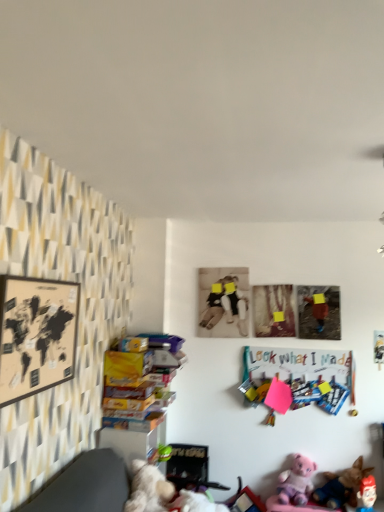
Question: Is fluffy white teddy bear at lower center, acting as the 1th toy starting from the front, to the left of plush pink bear at lower right, the 4th toy from the left, from the viewer's perspective?

Choices:
 (A) no
 (B) yes

Answer: (B)

Question: Is fluffy white teddy bear at lower center, positioned as the fourth toy in right-to-left order, smaller than plush pink bear at lower right, which ranks as the 2th toy in front-to-back order?

Choices:
 (A) yes
 (B) no

Answer: (B)

Question: Is fluffy white teddy bear at lower center, positioned as the fourth toy in right-to-left order, oriented towards plush pink bear at lower right, the 1th toy positioned from the right?

Choices:
 (A) no
 (B) yes

Answer: (A)

Question: Considering the relative positions of fluffy white teddy bear at lower center, acting as the 1th toy starting from the front, and plush pink bear at lower right, which ranks as the 2th toy in front-to-back order, in the image provided, is fluffy white teddy bear at lower center, acting as the 1th toy starting from the front, in front of plush pink bear at lower right, which ranks as the 2th toy in front-to-back order,?

Choices:
 (A) no
 (B) yes

Answer: (B)

Question: Is fluffy white teddy bear at lower center, acting as the 1th toy starting from the front, to the right of plush pink bear at lower right, the 1th toy positioned from the right, from the viewer's perspective?

Choices:
 (A) yes
 (B) no

Answer: (B)

Question: From a real-world perspective, is sepia-toned photo at center, which is counted as the third picture frame, starting from the front, physically located above or below pink plush bear at lower right, which is the 2th toy from left to right?

Choices:
 (A) below
 (B) above

Answer: (B)

Question: Does point (228, 279) appear closer or farther from the camera than point (301, 481)?

Choices:
 (A) closer
 (B) farther

Answer: (B)

Question: From the image's perspective, is sepia-toned photo at center, which is counted as the third picture frame, starting from the front, above or below pink plush bear at lower right, the 1th toy viewed from the back?

Choices:
 (A) below
 (B) above

Answer: (B)

Question: Do you think sepia-toned photo at center, which is counted as the third picture frame, starting from the front, is within pink plush bear at lower right, which appears as the fourth toy when viewed from the front, or outside of it?

Choices:
 (A) outside
 (B) inside

Answer: (A)

Question: Considering their positions, is colorful paperboard at center right located in front of or behind sepia-toned photo at center, arranged as the 1th picture frame when viewed from the back?

Choices:
 (A) front
 (B) behind

Answer: (A)

Question: In terms of height, does colorful paperboard at center right look taller or shorter compared to sepia-toned photo at center, arranged as the 2th picture frame when viewed from the left?

Choices:
 (A) tall
 (B) short

Answer: (B)

Question: Would you say colorful paperboard at center right is inside or outside sepia-toned photo at center, placed as the second picture frame when sorted from right to left?

Choices:
 (A) outside
 (B) inside

Answer: (A)

Question: Based on their sizes in the image, would you say colorful paperboard at center right is bigger or smaller than sepia-toned photo at center, placed as the second picture frame when sorted from right to left?

Choices:
 (A) big
 (B) small

Answer: (B)

Question: Is soft plush dog at lower right, which appears as the third toy when viewed from the left, bigger or smaller than sepia-toned photo at center, arranged as the 2th picture frame when viewed from the left?

Choices:
 (A) small
 (B) big

Answer: (B)

Question: Is soft plush dog at lower right, arranged as the 3th toy when viewed from the front, in front of or behind sepia-toned photo at center, which is counted as the third picture frame, starting from the front, in the image?

Choices:
 (A) front
 (B) behind

Answer: (A)